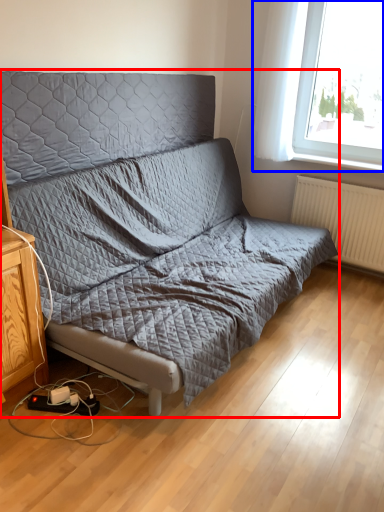
Question: Which point is further to the camera, studio couch (highlighted by a red box) or window (highlighted by a blue box)?

Choices:
 (A) studio couch
 (B) window

Answer: (B)